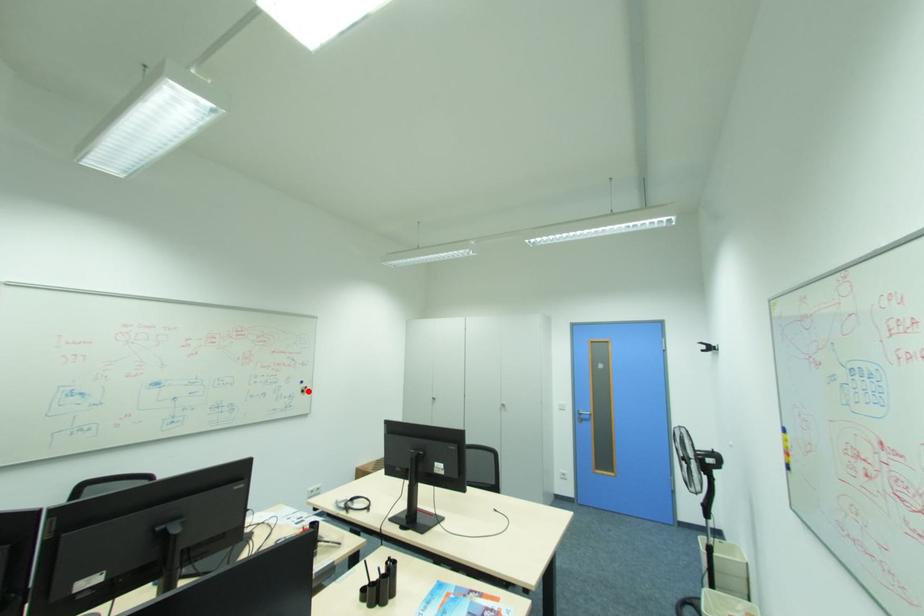
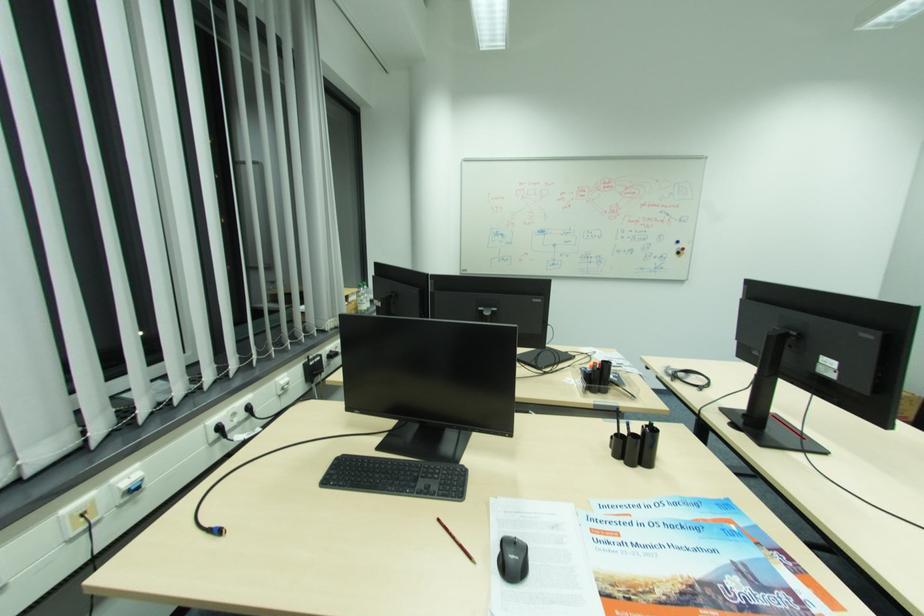
In the second image, find the point that corresponds to the highlighted location in the first image.

(684, 253)